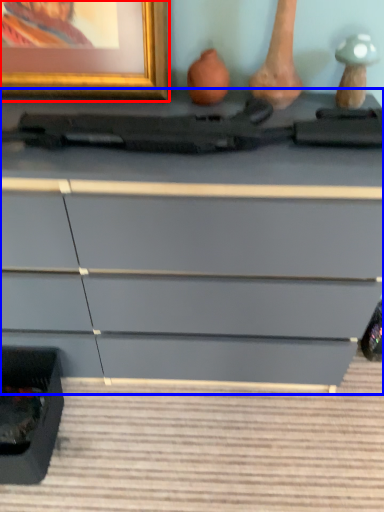
Question: Which of the following is the closest to the observer, picture frame (highlighted by a red box) or chest of drawers (highlighted by a blue box)?

Choices:
 (A) picture frame
 (B) chest of drawers

Answer: (B)